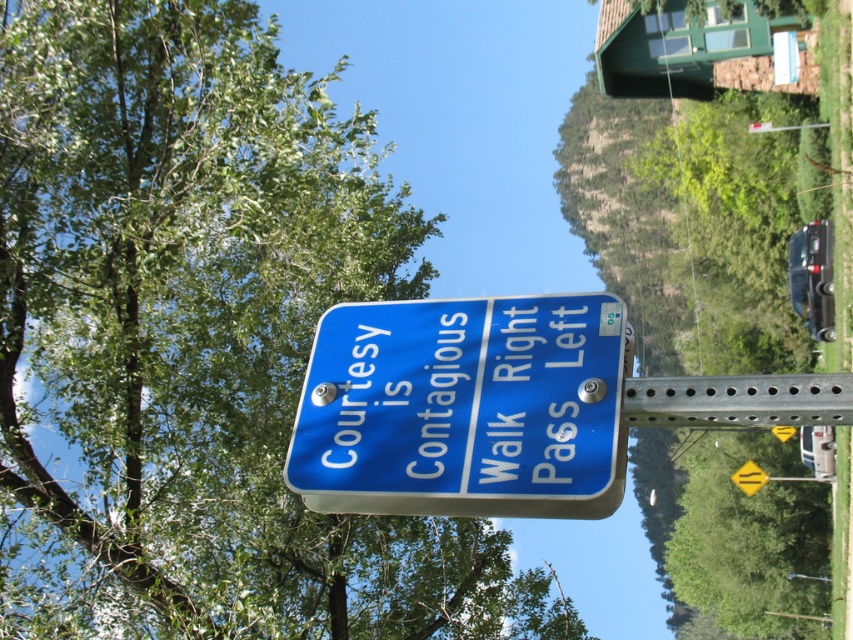
Image resolution: width=853 pixels, height=640 pixels. What do you see at coordinates (200, 340) in the screenshot?
I see `green leafy tree at upper left` at bounding box center [200, 340].

How distant is green leafy tree at upper left from blue metallic sign at center?

green leafy tree at upper left and blue metallic sign at center are 4.75 meters apart.

Locate an element on the screen. This screenshot has width=853, height=640. green leafy tree at upper left is located at coordinates (200, 340).

In the scene shown: Between blue metallic sign at center and yellow reflective diamond at center, which one has more height?

Standing taller between the two is yellow reflective diamond at center.

Is blue metallic sign at center thinner than yellow reflective diamond at center?

Indeed, blue metallic sign at center has a lesser width compared to yellow reflective diamond at center.

Between point (386, 362) and point (746, 470), which one is positioned behind?

Point (746, 470)

Where is `blue metallic sign at center`? Image resolution: width=853 pixels, height=640 pixels. blue metallic sign at center is located at coordinates (463, 408).

Is green leafy tree at upper left smaller than yellow reflective diamond at center?

No.

Which is more to the left, green leafy tree at upper left or yellow reflective diamond at center?

green leafy tree at upper left

Who is more distant from viewer, (115, 516) or (767, 477)?

Point (767, 477)

Locate an element on the screen. The height and width of the screenshot is (640, 853). green leafy tree at upper left is located at coordinates (200, 340).